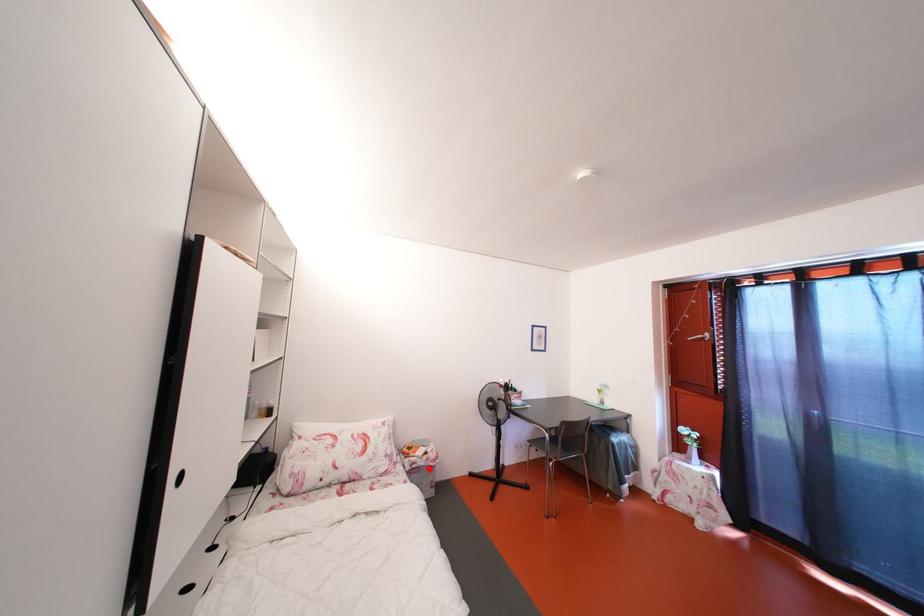
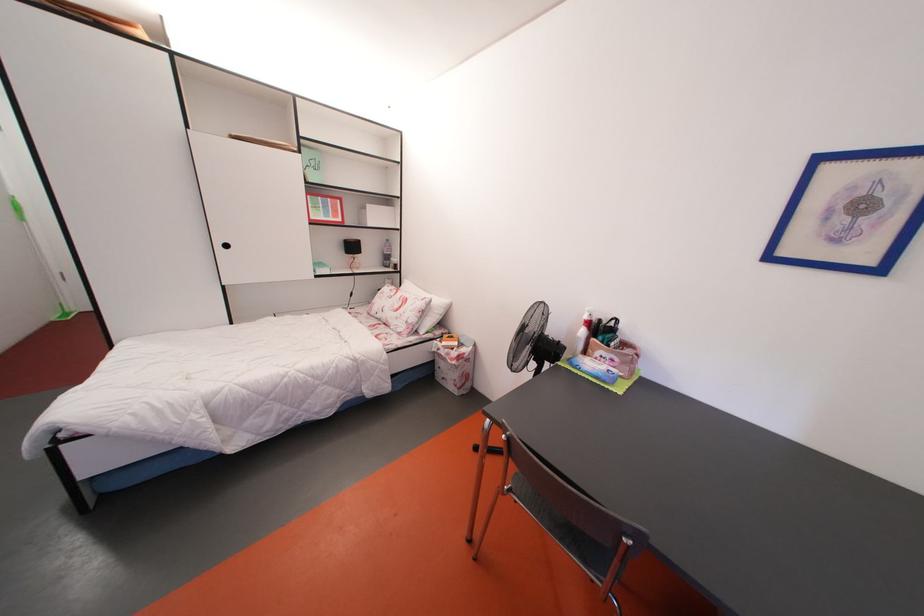
Find the pixel in the second image that matches the highlighted location in the first image.

(450, 360)